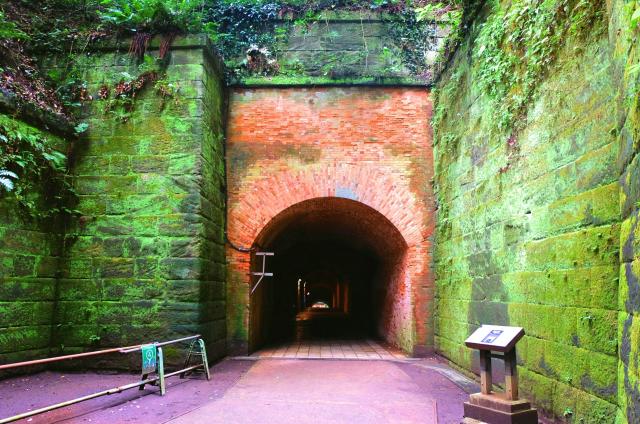
Locate an element on the screen. The height and width of the screenshot is (424, 640). plaque is located at coordinates click(x=509, y=336).